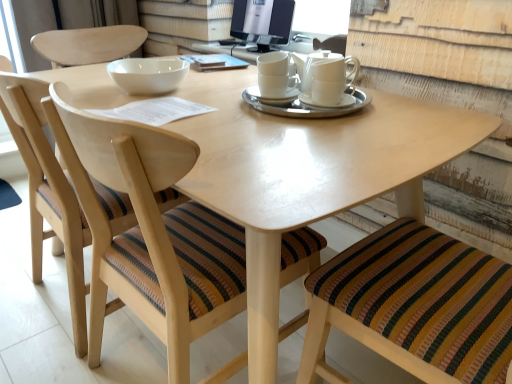
Question: Is white ceramic saucer at center, the first saucer positioned from the right, closer to camera compared to matte black monitor at upper center?

Choices:
 (A) yes
 (B) no

Answer: (A)

Question: Does white ceramic saucer at center, the first saucer positioned from the right, have a smaller size compared to matte black monitor at upper center?

Choices:
 (A) yes
 (B) no

Answer: (A)

Question: Is white ceramic saucer at center, the first saucer positioned from the right, at the left side of matte black monitor at upper center?

Choices:
 (A) yes
 (B) no

Answer: (B)

Question: Could you tell me if white ceramic saucer at center, the 3th saucer from the left, is turned towards matte black monitor at upper center?

Choices:
 (A) yes
 (B) no

Answer: (B)

Question: Can you confirm if white ceramic saucer at center, the first saucer positioned from the right, is shorter than matte black monitor at upper center?

Choices:
 (A) no
 (B) yes

Answer: (B)

Question: Is white ceramic saucer at center, the 3th saucer from the left, touching matte black monitor at upper center?

Choices:
 (A) no
 (B) yes

Answer: (A)

Question: From the image's perspective, is wooden chair with striped cushion at center, the 2th chair in the left-to-right sequence, located above striped fabric chair at lower right, the third chair positioned from the left?

Choices:
 (A) no
 (B) yes

Answer: (B)

Question: Are wooden chair with striped cushion at center, the 2th chair in the left-to-right sequence, and striped fabric chair at lower right, positioned as the first chair in right-to-left order, beside each other?

Choices:
 (A) yes
 (B) no

Answer: (B)

Question: From a real-world perspective, is wooden chair with striped cushion at center, the 2th chair in the left-to-right sequence, under striped fabric chair at lower right, the third chair positioned from the left?

Choices:
 (A) yes
 (B) no

Answer: (A)

Question: Can you confirm if wooden chair with striped cushion at center, the 2th chair in the left-to-right sequence, is thinner than striped fabric chair at lower right, the third chair positioned from the left?

Choices:
 (A) yes
 (B) no

Answer: (B)

Question: Is wooden chair with striped cushion at center, the 2th chair in the left-to-right sequence, not near striped fabric chair at lower right, positioned as the first chair in right-to-left order?

Choices:
 (A) no
 (B) yes

Answer: (A)

Question: Can you confirm if wooden chair with striped cushion at center, the 2th chair in the left-to-right sequence, is bigger than striped fabric chair at lower right, the third chair positioned from the left?

Choices:
 (A) yes
 (B) no

Answer: (A)

Question: Considering the relative sizes of white glossy bowl at upper center and white ceramic saucer at center, the first saucer positioned from the right, in the image provided, is white glossy bowl at upper center taller than white ceramic saucer at center, the first saucer positioned from the right,?

Choices:
 (A) yes
 (B) no

Answer: (A)